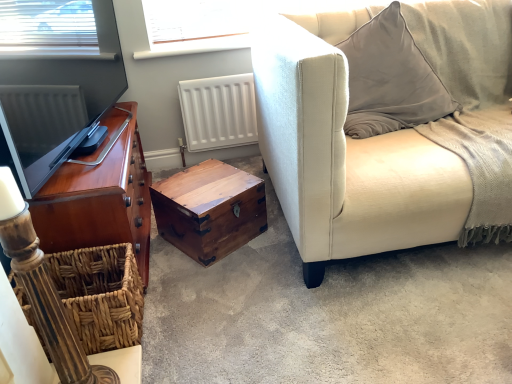
Question: Visually, is woven brown basket at lower left positioned to the left or to the right of suede beige couch at right?

Choices:
 (A) left
 (B) right

Answer: (A)

Question: Is woven brown basket at lower left in front of or behind suede beige couch at right in the image?

Choices:
 (A) front
 (B) behind

Answer: (B)

Question: Which of these objects is positioned closest to the shiny brown wood cabinet at left?

Choices:
 (A) wooden chest at center
 (B) suede beige couch at right
 (C) woven brown basket at lower left
 (D) wooden trunk at center

Answer: (C)

Question: Which object is the farthest from the suede beige couch at right?

Choices:
 (A) shiny brown wood cabinet at left
 (B) woven brown basket at lower left
 (C) wooden chest at center
 (D) wooden trunk at center

Answer: (B)